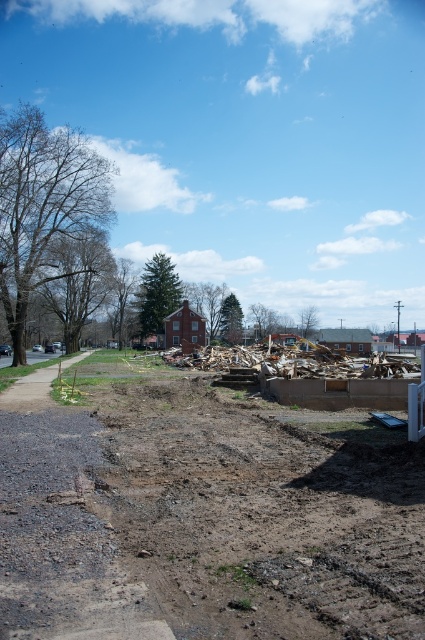
Question: Can you confirm if dull brown dirt at center is positioned above broken wood debris at center?

Choices:
 (A) yes
 (B) no

Answer: (A)

Question: Which object is positioned closest to the dull brown dirt at center?

Choices:
 (A) broken wood debris at center
 (B) gravel at left

Answer: (B)

Question: Estimate the real-world distances between objects in this image. Which object is closer to the broken wood debris at center?

Choices:
 (A) dull brown dirt at center
 (B) gravel at left

Answer: (A)

Question: Is dull brown dirt at center positioned behind gravel at left?

Choices:
 (A) no
 (B) yes

Answer: (A)

Question: Is the position of dull brown dirt at center less distant than that of gravel at left?

Choices:
 (A) no
 (B) yes

Answer: (B)

Question: Which object appears closest to the camera in this image?

Choices:
 (A) gravel at left
 (B) broken wood debris at center
 (C) dull brown dirt at center

Answer: (C)